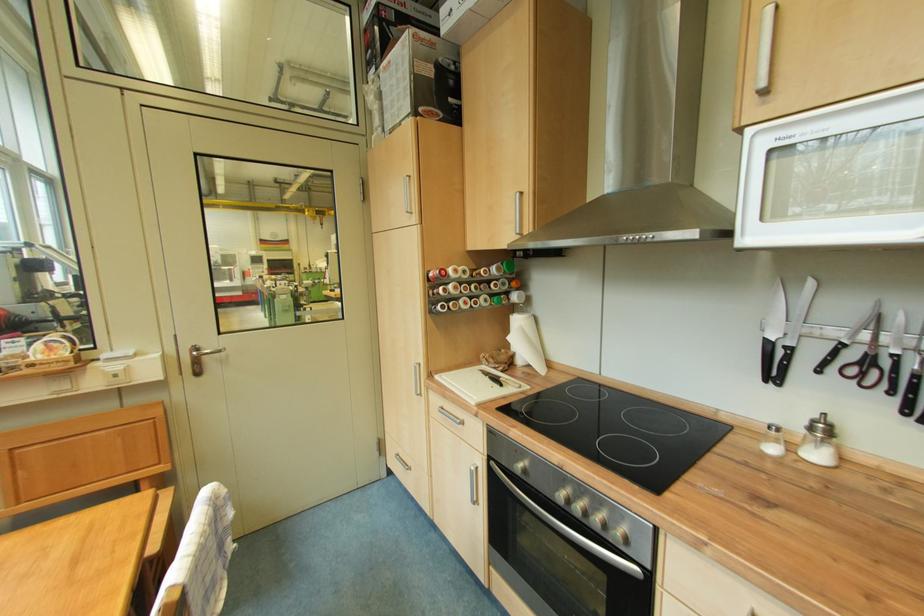
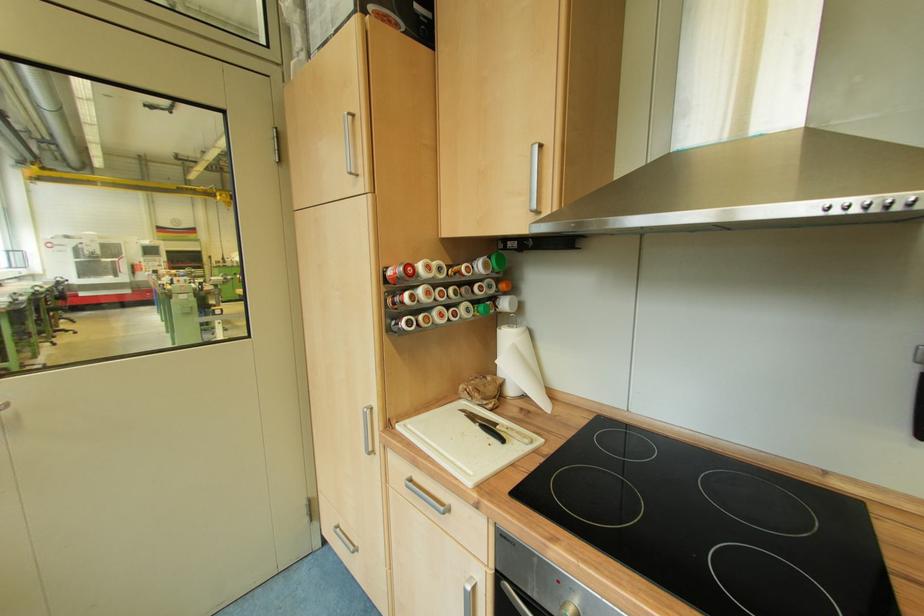
Question: The images are taken continuously from a first-person perspective. In which direction are you moving?

Choices:
 (A) Left
 (B) Right
 (C) Forward
 (D) Backward

Answer: (C)